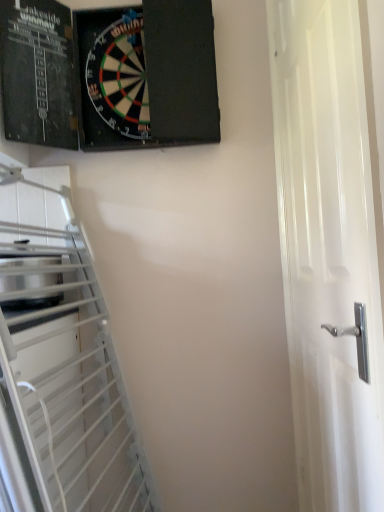
Question: Is white glossy door at right wider or thinner than black matte dartboard at upper left?

Choices:
 (A) wide
 (B) thin

Answer: (B)

Question: Is white glossy door at right inside or outside of black matte dartboard at upper left?

Choices:
 (A) inside
 (B) outside

Answer: (B)

Question: Is point (301, 381) positioned closer to the camera than point (155, 129)?

Choices:
 (A) closer
 (B) farther

Answer: (A)

Question: Considering the positions of black matte dartboard at upper left and white glossy door at right in the image, is black matte dartboard at upper left wider or thinner than white glossy door at right?

Choices:
 (A) wide
 (B) thin

Answer: (A)

Question: Considering the positions of black matte dartboard at upper left and white glossy door at right in the image, is black matte dartboard at upper left bigger or smaller than white glossy door at right?

Choices:
 (A) small
 (B) big

Answer: (A)

Question: Considering their positions, is black matte dartboard at upper left located in front of or behind white glossy door at right?

Choices:
 (A) front
 (B) behind

Answer: (B)

Question: In the image, is black matte dartboard at upper left on the left side or the right side of white glossy door at right?

Choices:
 (A) right
 (B) left

Answer: (B)